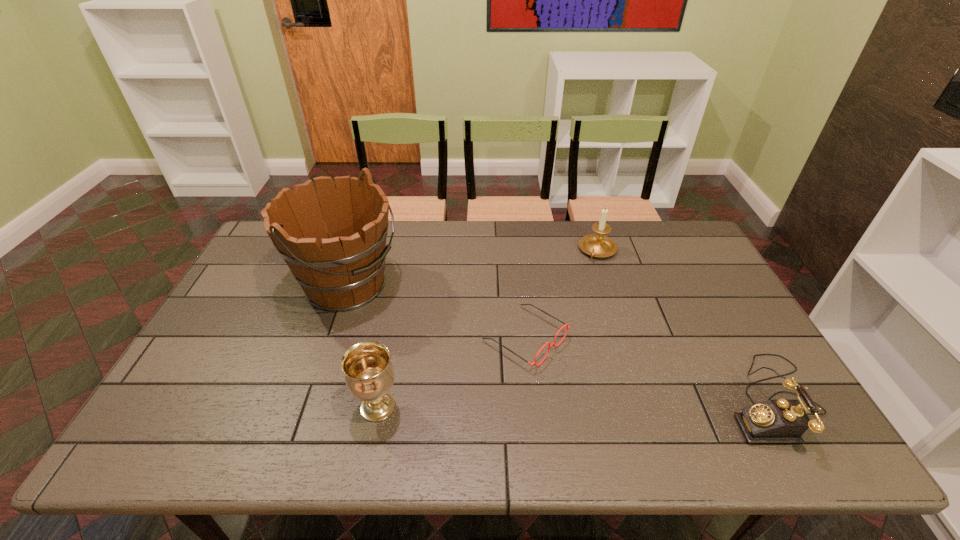
Find the location of `free space located on the dial of the telephone`. free space located on the dial of the telephone is located at coordinates (605, 401).

Image resolution: width=960 pixels, height=540 pixels. What are the coordinates of `vacant point located 0.090m with the handle on the wine bucket` in the screenshot? It's located at (412, 320).

Image resolution: width=960 pixels, height=540 pixels. I want to click on vacant position located 0.160m with the handle on the wine bucket, so click(x=431, y=329).

Locate an element on the screen. vacant space located 0.140m with the handle on the wine bucket is located at coordinates (425, 326).

Find the location of a particular element. This screenshot has width=960, height=540. vacant space situated 0.170m on the front-facing side of the third object from left to right is located at coordinates (622, 398).

Find the location of a particular element. This screenshot has width=960, height=540. vacant point located 0.170m on the front-facing side of the third object from left to right is located at coordinates (622, 398).

Identify the location of vacant region located 0.170m on the front-facing side of the third object from left to right. (622, 398).

Find the location of a particular element. The image size is (960, 540). vacant space situated with a handle on the side of the second object from right to left is located at coordinates (584, 287).

Identify the location of vacant space located 0.400m with a handle on the side of the second object from right to left. This screenshot has width=960, height=540. (558, 348).

Find the location of a particular element. The height and width of the screenshot is (540, 960). free space located with a handle on the side of the second object from right to left is located at coordinates pos(589,272).